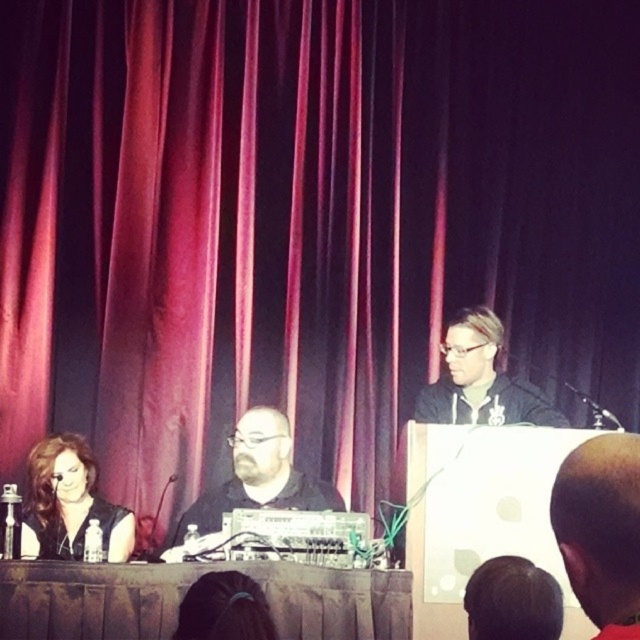
Question: Is brown fabric table at center closer to the viewer compared to shiny black hair at lower left?

Choices:
 (A) no
 (B) yes

Answer: (B)

Question: Among these objects, which one is nearest to the camera?

Choices:
 (A) matte black hoodie at center
 (B) black matte shirt at center

Answer: (B)

Question: Observing the image, what is the correct spatial positioning of black matte shirt at center in reference to matte black hoodie at center?

Choices:
 (A) right
 (B) left

Answer: (B)

Question: Considering the real-world distances, which object is closest to the black matte shirt at center?

Choices:
 (A) brown fabric table at center
 (B) shiny black hair at lower left
 (C) matte black hoodie at center
 (D) bald head at center

Answer: (B)

Question: Observing the image, what is the correct spatial positioning of brown fabric table at center in reference to bald head at center?

Choices:
 (A) left
 (B) right

Answer: (A)

Question: Which object is positioned farthest from the shiny black hair at lower left?

Choices:
 (A) bald head at center
 (B) matte black hoodie at center
 (C) brown fabric table at center

Answer: (A)